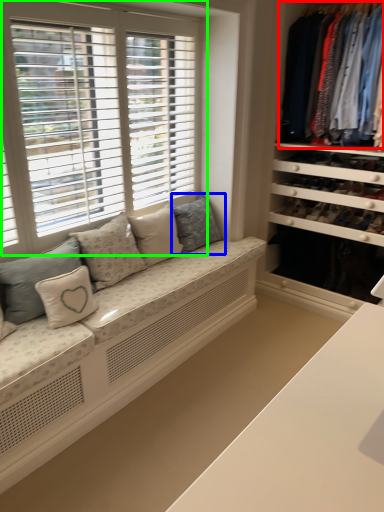
Question: Which object is positioned closest to clothing (highlighted by a red box)? Select from pillow (highlighted by a blue box) and window (highlighted by a green box).

Choices:
 (A) pillow
 (B) window

Answer: (A)